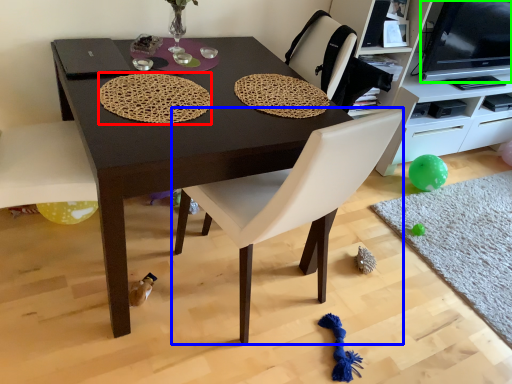
Question: Considering the real-world distances, which object is farthest from mat (highlighted by a red box)? chair (highlighted by a blue box) or television (highlighted by a green box)?

Choices:
 (A) chair
 (B) television

Answer: (B)